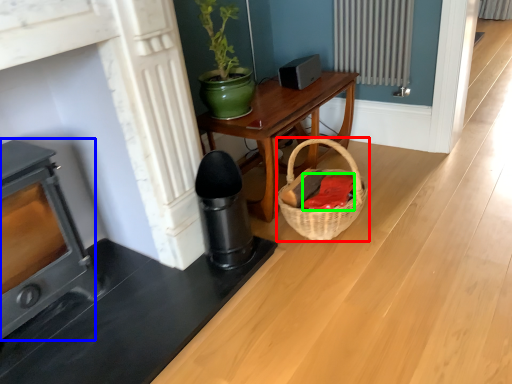
Question: Estimate the real-world distances between objects in this image. Which object is closer to basket (highlighted by a red box), heater (highlighted by a blue box) or material (highlighted by a green box)?

Choices:
 (A) heater
 (B) material

Answer: (B)